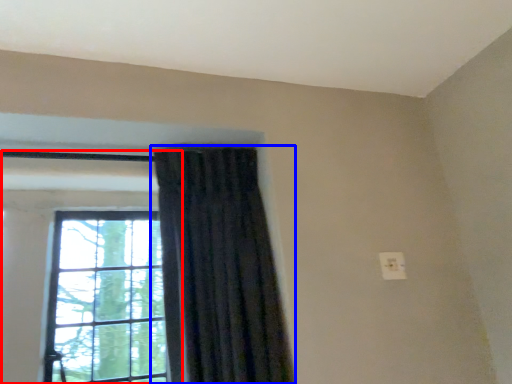
Question: Which point is closer to the camera, window (highlighted by a red box) or curtain (highlighted by a blue box)?

Choices:
 (A) window
 (B) curtain

Answer: (B)